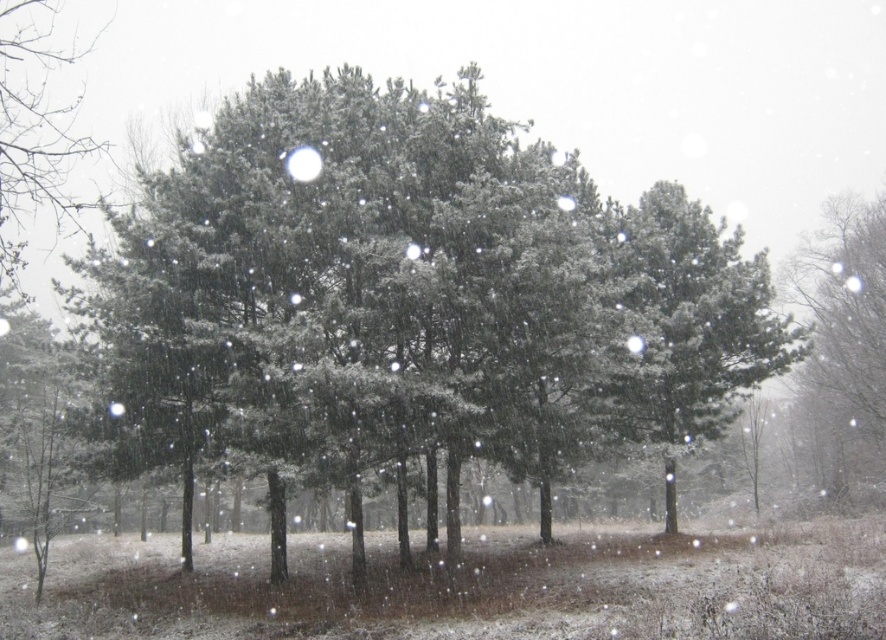
Who is positioned more to the right, needle-like green pine at center or snow-covered pine tree at right?

snow-covered pine tree at right is more to the right.

Which of these two, needle-like green pine at center or snow-covered pine tree at right, stands taller?

snow-covered pine tree at right is taller.

Is point (670, 195) behind point (807, 253)?

No, (670, 195) is closer to viewer.

Where is `needle-like green pine at center`? Image resolution: width=886 pixels, height=640 pixels. needle-like green pine at center is located at coordinates (692, 326).

Which of these two, needle-like green pine at center or green matte tree at left, stands taller?

green matte tree at left is taller.

Is point (729, 419) less distant than point (24, 152)?

Yes, it is.

At what (x,y) coordinates should I click in order to perform the action: click on needle-like green pine at center. Please return your answer as a coordinate pair (x, y). Looking at the image, I should click on [692, 326].

Is snow-covered pine tree at right to the left of green matte tree at left from the viewer's perspective?

In fact, snow-covered pine tree at right is to the right of green matte tree at left.

Is point (811, 353) positioned in front of point (33, 161)?

That is True.

Image resolution: width=886 pixels, height=640 pixels. I want to click on snow-covered pine tree at right, so click(x=844, y=342).

Where is `snow-covered pine tree at right`? snow-covered pine tree at right is located at coordinates (844, 342).